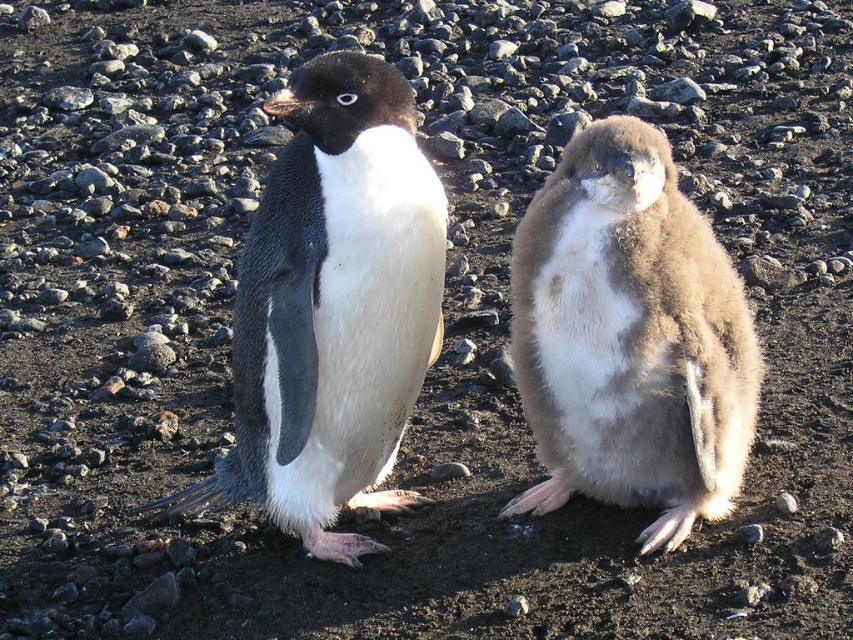
Does point (273, 368) come closer to viewer compared to point (630, 362)?

Yes, it is in front of point (630, 362).

Does matte black penguin at left appear over brown fluffy penguin at right?

Indeed, matte black penguin at left is positioned over brown fluffy penguin at right.

The width and height of the screenshot is (853, 640). In order to click on matte black penguin at left in this screenshot , I will do `click(332, 307)`.